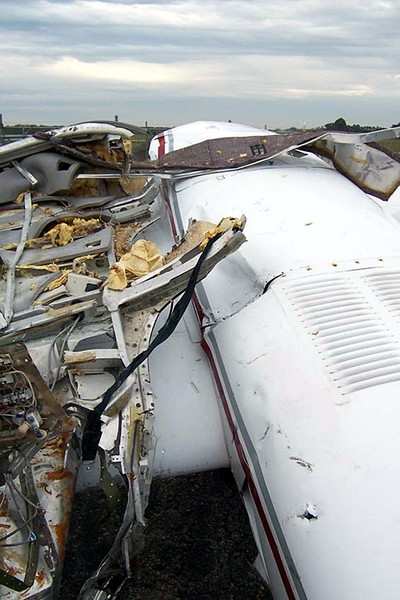
I want to click on vent, so click(x=376, y=370), click(x=381, y=283), click(x=329, y=312).